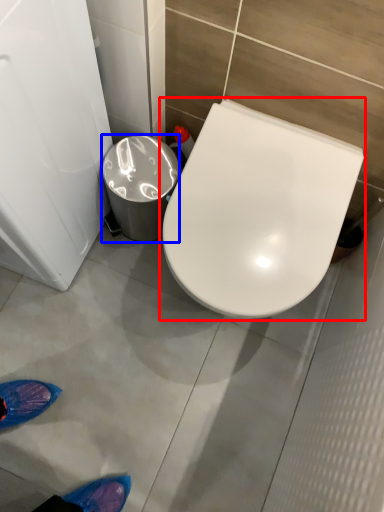
Question: Which of the following is the closest to the observer, toilet (highlighted by a red box) or trash bin/can (highlighted by a blue box)?

Choices:
 (A) toilet
 (B) trash bin/can

Answer: (A)